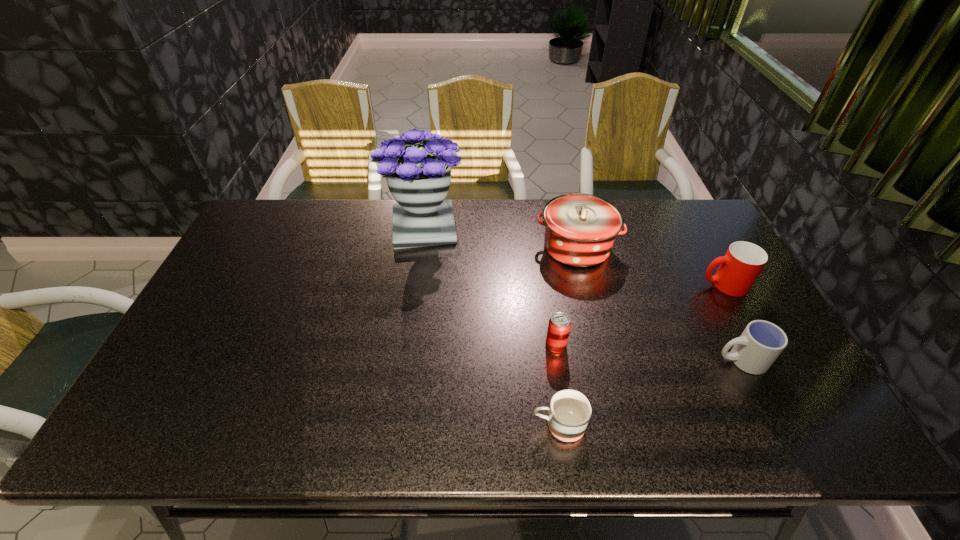
Find the location of a particular element. vacant space that satisfies the following two spatial constraints: 1. on the front side of the second tallest object; 2. on the side of the farther cup with the handle is located at coordinates (586, 285).